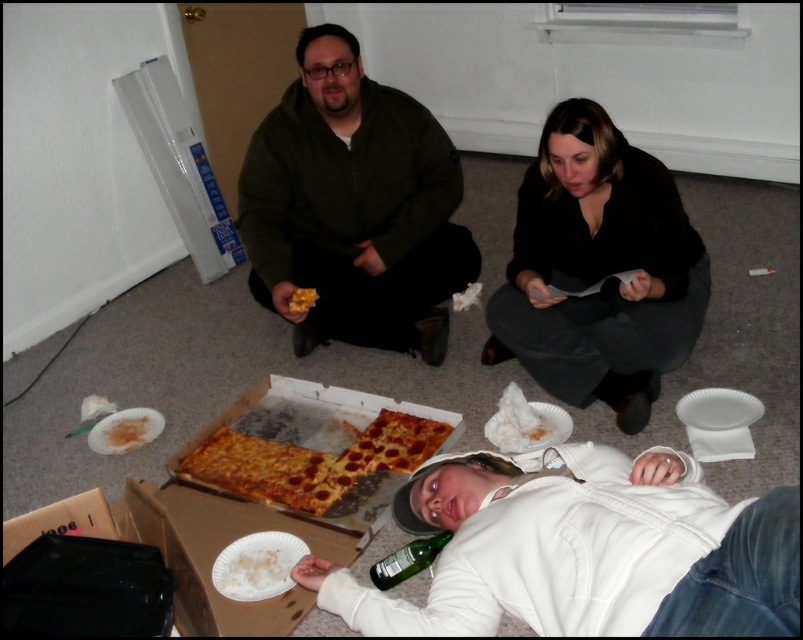
You are standing at the entrance of the living room and want to grab the cardboard pizza box at center. Which direction should you move to reach it?

The cardboard pizza box at center is located at point 0.791 on the x and 0.328 on the y coordinates. Since you are at the entrance, you should move towards the center of the room to reach it.

You are at a friend gathering in the living room. You want to grab the yellow cheese pizza at center without moving the cardboard pizza box at center. Is it possible?

The cardboard pizza box at center is to the left of yellow cheese pizza at center, so you can reach the yellow cheese pizza at center by moving to its right side without disturbing the box.